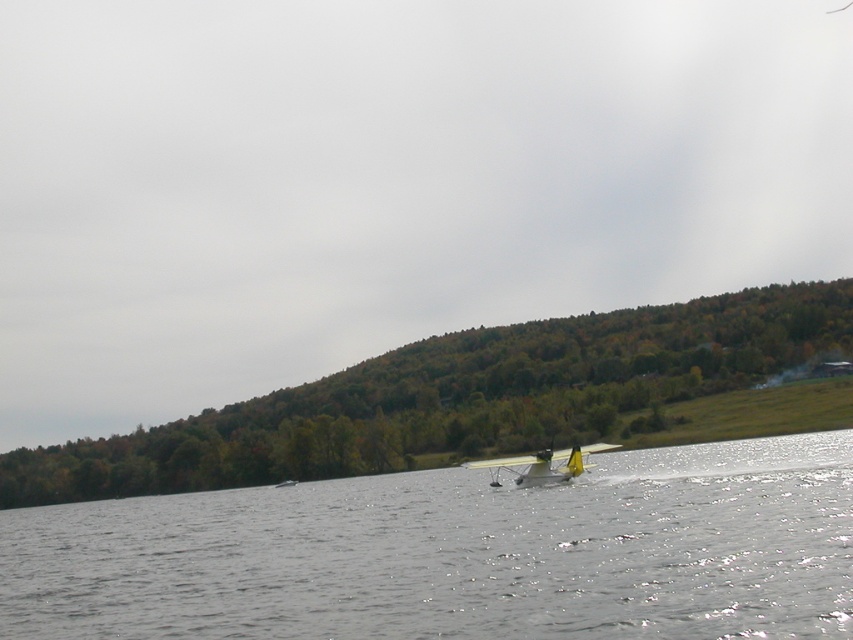
You are a pilot planning to take off from the lakeside. The yellow matte seaplane at center is your aircraft. There is a green leafy hillside at center nearby. Do you think there is enough space between them for the seaplane to accelerate and take off safely?

The green leafy hillside at center is 76.53 meters away from the yellow matte seaplane at center. This distance should be sufficient for the seaplane to accelerate and take off safely, assuming typical takeoff run requirements are met.

In the scene shown: You are a photographer planning to capture the entire scene in one shot. Given that the green leafy hillside at center and the yellow matte seaplane at center are both in the frame, which object will occupy more horizontal space in the photograph?

The green leafy hillside at center occupies more horizontal space in the photograph because its width is larger than that of the yellow matte seaplane at center.

You are standing at the lakeside and want to take a photo of the clear water at center and the green leafy hillside at center. Which one should you focus on first if you want both to be in sharp focus?

You should focus on the green leafy hillside at center first because it is farther away than the clear water at center, ensuring both will be in focus when using depth of field.